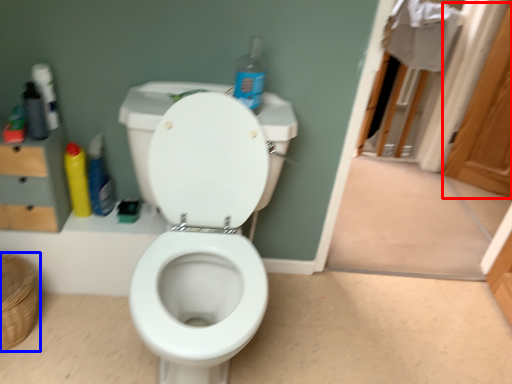
Question: Which object appears farthest to the camera in this image, screen door (highlighted by a red box) or basket (highlighted by a blue box)?

Choices:
 (A) screen door
 (B) basket

Answer: (A)